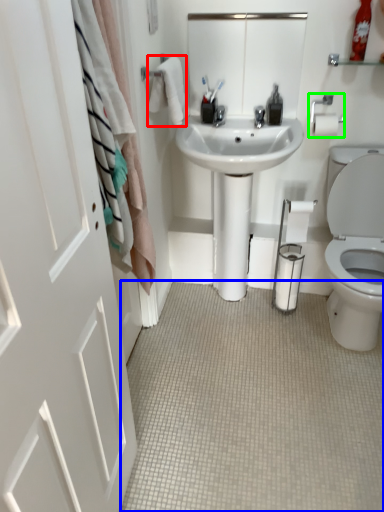
Question: Based on their relative distances, which object is nearer to bath towel (highlighted by a red box)? Choose from plain (highlighted by a blue box) and towel bar (highlighted by a green box).

Choices:
 (A) plain
 (B) towel bar

Answer: (B)